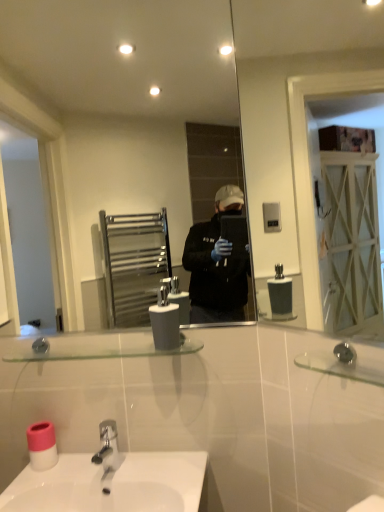
Question: Is clear glass mirror at upper right, the 2th mirror in the left-to-right sequence, bigger than clear glass shelf at center?

Choices:
 (A) no
 (B) yes

Answer: (B)

Question: Is clear glass mirror at upper right, which is counted as the 1th mirror, starting from the front, positioned with its back to clear glass shelf at center?

Choices:
 (A) no
 (B) yes

Answer: (A)

Question: Is the position of clear glass mirror at upper right, placed as the 1th mirror when sorted from right to left, less distant than that of clear glass shelf at center?

Choices:
 (A) no
 (B) yes

Answer: (B)

Question: Are clear glass mirror at upper right, positioned as the 2th mirror in back-to-front order, and clear glass shelf at center far apart?

Choices:
 (A) yes
 (B) no

Answer: (A)

Question: From a real-world perspective, is clear glass mirror at upper right, which is counted as the 1th mirror, starting from the front, on clear glass shelf at center?

Choices:
 (A) yes
 (B) no

Answer: (A)

Question: Choose the correct answer: Is clear glass shelf at center inside pink plastic toilet paper at lower left or outside it?

Choices:
 (A) inside
 (B) outside

Answer: (B)

Question: Would you say clear glass shelf at center is to the left or to the right of pink plastic toilet paper at lower left in the picture?

Choices:
 (A) right
 (B) left

Answer: (A)

Question: From the image's perspective, is clear glass shelf at center located above or below pink plastic toilet paper at lower left?

Choices:
 (A) below
 (B) above

Answer: (B)

Question: From a real-world perspective, is clear glass shelf at center above or below pink plastic toilet paper at lower left?

Choices:
 (A) below
 (B) above

Answer: (B)

Question: From the image's perspective, is white matte soap dispenser at center located above or below clear glass mirror at upper right, which is counted as the 1th mirror, starting from the front?

Choices:
 (A) below
 (B) above

Answer: (A)

Question: Is white matte soap dispenser at center spatially inside clear glass mirror at upper right, positioned as the 2th mirror in back-to-front order, or outside of it?

Choices:
 (A) inside
 (B) outside

Answer: (B)

Question: Considering the positions of white matte soap dispenser at center and clear glass mirror at upper right, positioned as the 2th mirror in back-to-front order, in the image, is white matte soap dispenser at center wider or thinner than clear glass mirror at upper right, positioned as the 2th mirror in back-to-front order,?

Choices:
 (A) thin
 (B) wide

Answer: (B)

Question: Relative to clear glass mirror at upper right, the 2th mirror in the left-to-right sequence, is white matte soap dispenser at center in front or behind?

Choices:
 (A) behind
 (B) front

Answer: (A)

Question: Is point (244, 22) positioned closer to the camera than point (157, 330)?

Choices:
 (A) closer
 (B) farther

Answer: (B)

Question: From the image's perspective, is clear glass mirror at upper right, positioned as the 2th mirror in back-to-front order, above or below white matte soap dispenser at center?

Choices:
 (A) below
 (B) above

Answer: (B)